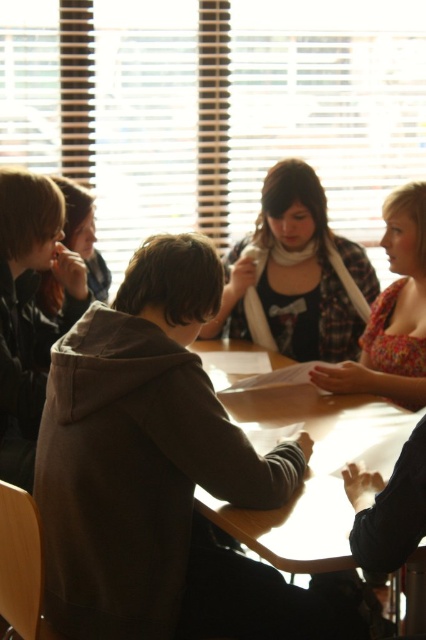
You are standing at the point with coordinates (141, 451) in the image. What object are you standing on?

You are standing on the dark brown hoodie at center.

You are a person who is 1.8 meters tall and standing in front of the table. You want to hand a document to the person wearing the dark brown hoodie at center. Can you reach them without moving closer?

The dark brown hoodie at center is 1.25 meters away from the viewer. Since the average arm length for a person of 1.8 meters is around 0.7 meters, you cannot reach them without moving closer.

You are standing in front of the table and want to place a small object on the table. The table has two spots marked as point A at coordinates point A is at point (279, 300) and point B is at point (411, 232). Which point is closer to you, point A or point B?

Point A at point (279, 300) is closer to you because it is further to the camera than point B at point (411, 232).